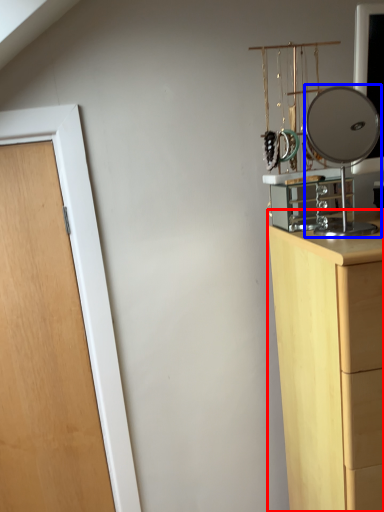
Question: Among these objects, which one is nearest to the camera, chest of drawers (highlighted by a red box) or mirror (highlighted by a blue box)?

Choices:
 (A) chest of drawers
 (B) mirror

Answer: (A)